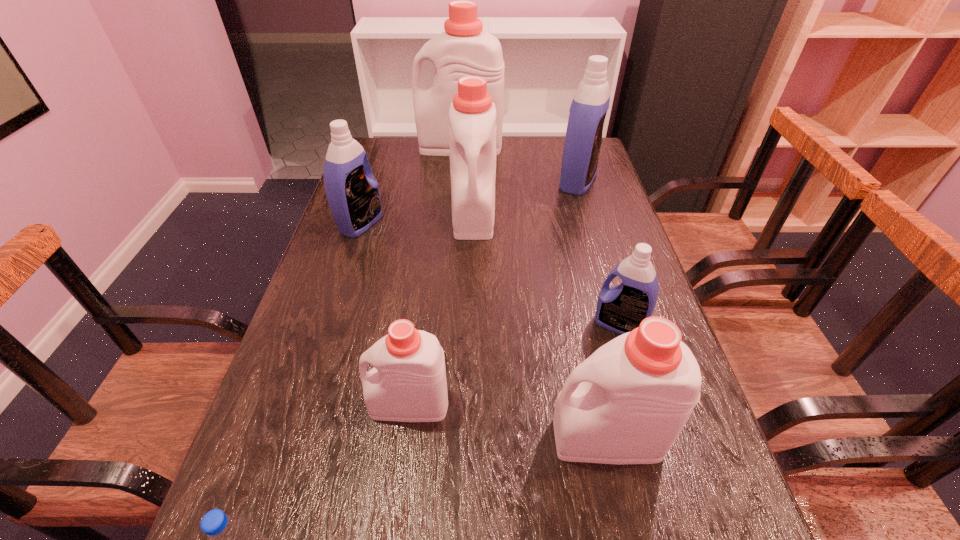
Locate an element on the screen. the tallest object is located at coordinates (464, 49).

Identify the location of the farthest white detergent. Image resolution: width=960 pixels, height=540 pixels. (464, 49).

Identify the location of the second biggest white detergent. (472, 116).

Where is `the biggest blue detergent`? The width and height of the screenshot is (960, 540). the biggest blue detergent is located at coordinates (583, 139).

The width and height of the screenshot is (960, 540). I want to click on the second biggest blue detergent, so click(x=353, y=196).

Image resolution: width=960 pixels, height=540 pixels. In order to click on the second farthest blue detergent in this screenshot , I will do `click(353, 196)`.

Find the location of a particular element. the rightmost white detergent is located at coordinates (627, 403).

Image resolution: width=960 pixels, height=540 pixels. I want to click on the smallest white detergent, so coord(408,383).

I want to click on the smallest blue detergent, so pyautogui.click(x=621, y=309).

Find the location of a particular element. The image size is (960, 540). the nearest blue detergent is located at coordinates (621, 309).